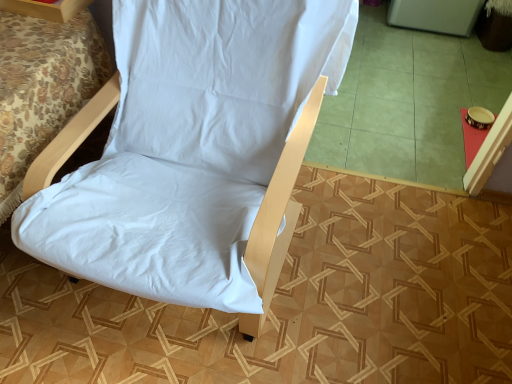
Locate an element on the screen. free point above green tile at center (from a real-world perspective) is located at coordinates (425, 91).